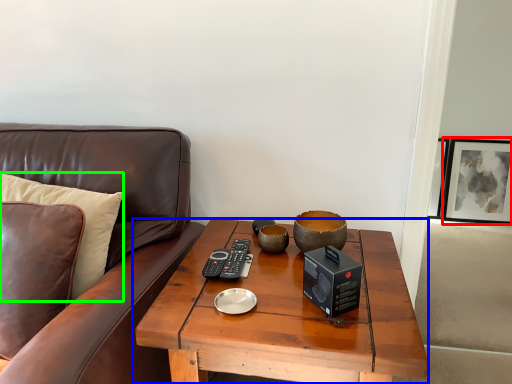
Question: Based on their relative distances, which object is nearer to picture frame (highlighted by a red box)? Choose from coffee table (highlighted by a blue box) and pillow (highlighted by a green box).

Choices:
 (A) coffee table
 (B) pillow

Answer: (A)